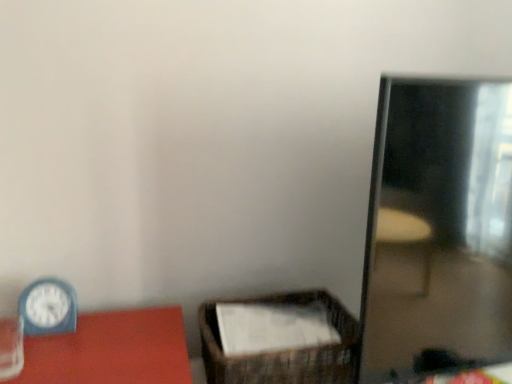
Question: Is brown woven basket at center smaller than blue plastic clock at left?

Choices:
 (A) yes
 (B) no

Answer: (B)

Question: Does brown woven basket at center have a greater width compared to blue plastic clock at left?

Choices:
 (A) no
 (B) yes

Answer: (B)

Question: Is brown woven basket at center shorter than blue plastic clock at left?

Choices:
 (A) no
 (B) yes

Answer: (B)

Question: Does brown woven basket at center have a greater height compared to blue plastic clock at left?

Choices:
 (A) yes
 (B) no

Answer: (B)

Question: From the image's perspective, is brown woven basket at center located beneath blue plastic clock at left?

Choices:
 (A) no
 (B) yes

Answer: (B)

Question: Is brown woven basket at center closer to camera compared to blue plastic clock at left?

Choices:
 (A) no
 (B) yes

Answer: (A)

Question: Can you confirm if blue plastic clock at left is smaller than shiny reflective mirror at right?

Choices:
 (A) no
 (B) yes

Answer: (B)

Question: Is blue plastic clock at left shorter than shiny reflective mirror at right?

Choices:
 (A) no
 (B) yes

Answer: (B)

Question: Does blue plastic clock at left come behind shiny reflective mirror at right?

Choices:
 (A) no
 (B) yes

Answer: (B)

Question: Can you confirm if blue plastic clock at left is wider than shiny reflective mirror at right?

Choices:
 (A) no
 (B) yes

Answer: (A)

Question: Would you say shiny reflective mirror at right is part of blue plastic clock at left's contents?

Choices:
 (A) no
 (B) yes

Answer: (A)

Question: Is blue plastic clock at left not near shiny reflective mirror at right?

Choices:
 (A) no
 (B) yes

Answer: (A)

Question: From a real-world perspective, is shiny reflective mirror at right on brown woven basket at center?

Choices:
 (A) no
 (B) yes

Answer: (B)